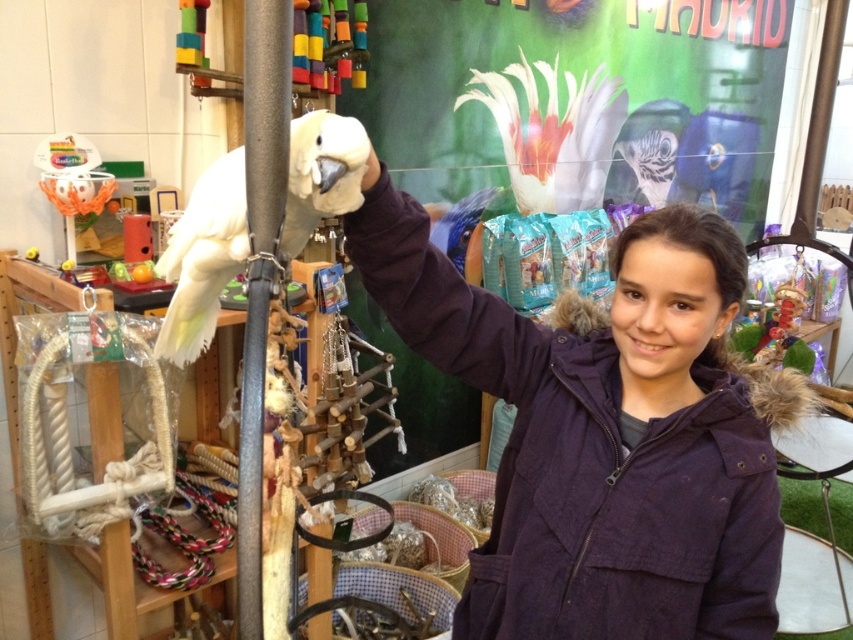
Which is below, purple cotton jacket at center or white feathered parrot at center?

purple cotton jacket at center

How much distance is there between purple cotton jacket at center and white feathered parrot at center?

purple cotton jacket at center is 15.27 inches away from white feathered parrot at center.

What do you see at coordinates (604, 435) in the screenshot? The image size is (853, 640). I see `purple cotton jacket at center` at bounding box center [604, 435].

In order to click on purple cotton jacket at center in this screenshot , I will do `click(604, 435)`.

Measure the distance between white feathered parrot at center and camera.

26.20 inches

You are a GUI agent. You are given a task and a screenshot of the screen. Output one action in this format:
    pyautogui.click(x=<x>, y=<y>)
    Task: Click on the white feathered parrot at center
    This screenshot has height=640, width=853.
    Given the screenshot: What is the action you would take?
    pyautogui.click(x=202, y=259)

The height and width of the screenshot is (640, 853). Identify the location of white feathered parrot at center. (202, 259).

The width and height of the screenshot is (853, 640). Find the location of `white feathered parrot at center`. white feathered parrot at center is located at coordinates (202, 259).

Can you confirm if purple cotton jacket at center is positioned to the right of black matte pole at center?

Yes, purple cotton jacket at center is to the right of black matte pole at center.

Between purple cotton jacket at center and black matte pole at center, which one has more height?

purple cotton jacket at center is taller.

Where is `purple cotton jacket at center`? Image resolution: width=853 pixels, height=640 pixels. purple cotton jacket at center is located at coordinates (604, 435).

This screenshot has width=853, height=640. Find the location of `purple cotton jacket at center`. purple cotton jacket at center is located at coordinates (604, 435).